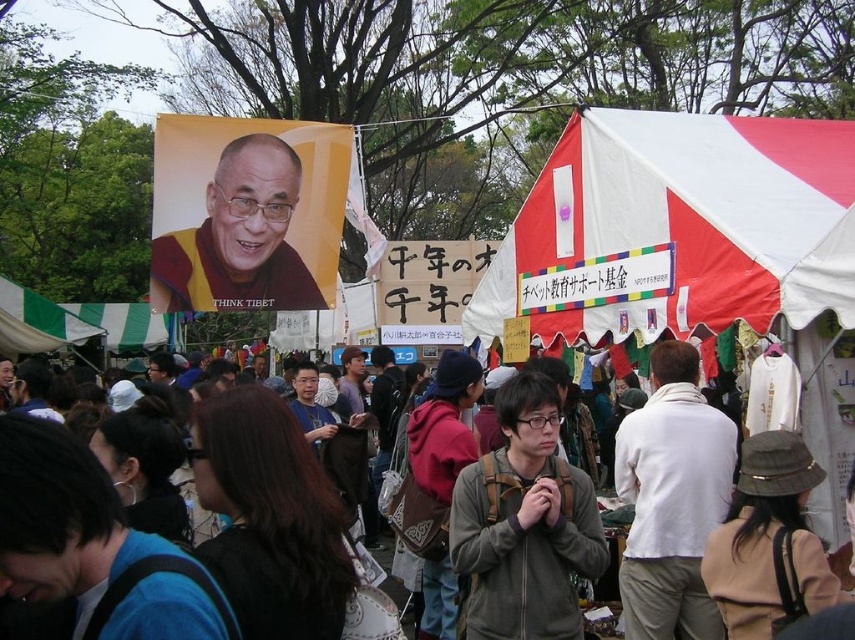
Does point (635, 275) lie in front of point (547, 362)?

Yes.

Is point (573, 241) positioned behind point (52, 627)?

Yes, it is.

This screenshot has height=640, width=855. Describe the element at coordinates (671, 227) in the screenshot. I see `red and white tent at upper right` at that location.

The height and width of the screenshot is (640, 855). I want to click on red and white tent at upper right, so click(671, 227).

Who is more distant from viewer, (268,145) or (37,611)?

A: Point (268,145)

Looking at this image, measure the distance between matte yellow fabric at upper left and brown hair at center.

matte yellow fabric at upper left and brown hair at center are 21.10 meters apart.

The width and height of the screenshot is (855, 640). Describe the element at coordinates (246, 237) in the screenshot. I see `matte yellow fabric at upper left` at that location.

You are a GUI agent. You are given a task and a screenshot of the screen. Output one action in this format:
    pyautogui.click(x=<x>, y=<y>)
    Task: Click on the matte yellow fabric at upper left
    
    Given the screenshot: What is the action you would take?
    pyautogui.click(x=246, y=237)

Is red and white tent at upper right shorter than matte yellow fabric at upper left?

Yes, red and white tent at upper right is shorter than matte yellow fabric at upper left.

Between red and white tent at upper right and matte yellow fabric at upper left, which one appears on the right side from the viewer's perspective?

red and white tent at upper right is more to the right.

Identify the location of red and white tent at upper right. Image resolution: width=855 pixels, height=640 pixels. [671, 227].